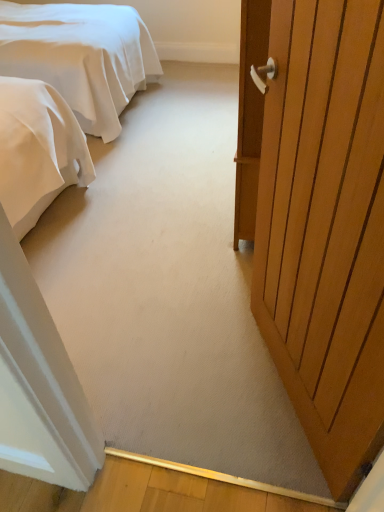
Question: From the image's perspective, is wooden door at right below white satin bed at upper left?

Choices:
 (A) no
 (B) yes

Answer: (B)

Question: Is wooden door at right far away from white satin bed at upper left?

Choices:
 (A) yes
 (B) no

Answer: (A)

Question: From a real-world perspective, is wooden door at right located higher than white satin bed at upper left?

Choices:
 (A) yes
 (B) no

Answer: (A)

Question: From a real-world perspective, is wooden door at right positioned under white satin bed at upper left based on gravity?

Choices:
 (A) no
 (B) yes

Answer: (A)

Question: Considering the relative sizes of wooden door at right and white satin bed at upper left in the image provided, is wooden door at right bigger than white satin bed at upper left?

Choices:
 (A) yes
 (B) no

Answer: (B)

Question: Does wooden door at right appear on the right side of white satin bed at upper left?

Choices:
 (A) no
 (B) yes

Answer: (B)

Question: Are white satin bed at upper left and wooden door at right far apart?

Choices:
 (A) yes
 (B) no

Answer: (A)

Question: Is wooden door at right at the back of white satin bed at upper left?

Choices:
 (A) no
 (B) yes

Answer: (A)

Question: Is white satin bed at upper left taller than wooden door at right?

Choices:
 (A) yes
 (B) no

Answer: (B)

Question: Does white satin bed at upper left lie behind wooden door at right?

Choices:
 (A) no
 (B) yes

Answer: (B)

Question: Can you confirm if white satin bed at upper left is shorter than wooden door at right?

Choices:
 (A) yes
 (B) no

Answer: (A)

Question: Does white satin bed at upper left have a larger size compared to wooden door at right?

Choices:
 (A) no
 (B) yes

Answer: (B)

Question: In terms of height, does white satin bed at upper left look taller or shorter compared to wooden door at right?

Choices:
 (A) short
 (B) tall

Answer: (A)